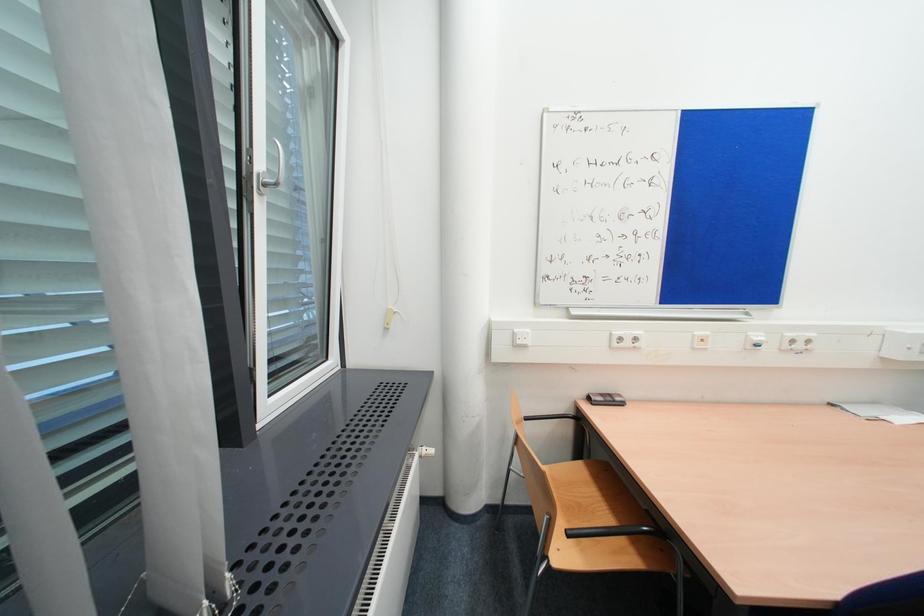
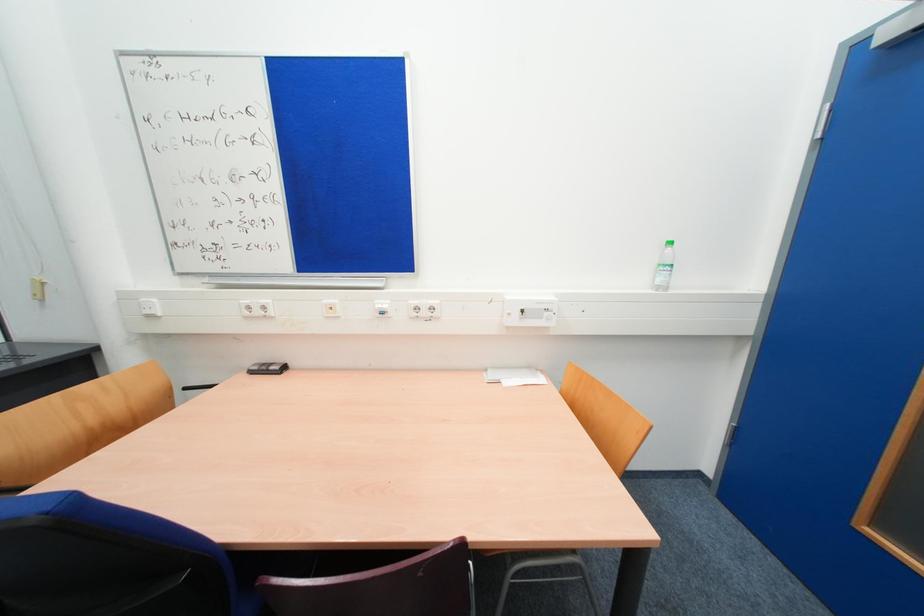
Question: In a continuous first-person perspective shot, in which direction is the camera moving?

Choices:
 (A) Left
 (B) Right
 (C) Forward
 (D) Backward

Answer: (B)